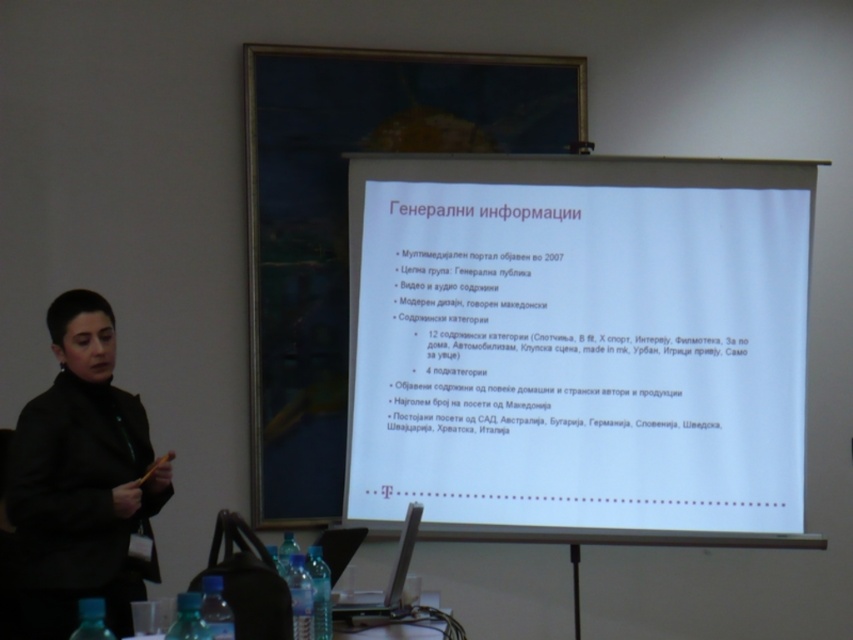
Question: Does white paper at center appear under black matte jacket at left?

Choices:
 (A) no
 (B) yes

Answer: (A)

Question: Can you confirm if white paper at center is wider than black matte jacket at left?

Choices:
 (A) no
 (B) yes

Answer: (B)

Question: Which object appears closest to the camera in this image?

Choices:
 (A) white paper at center
 (B) black matte jacket at left

Answer: (B)

Question: Which object is farther from the camera taking this photo?

Choices:
 (A) white paper at center
 (B) black matte jacket at left

Answer: (A)

Question: Is white paper at center above black matte jacket at left?

Choices:
 (A) yes
 (B) no

Answer: (A)